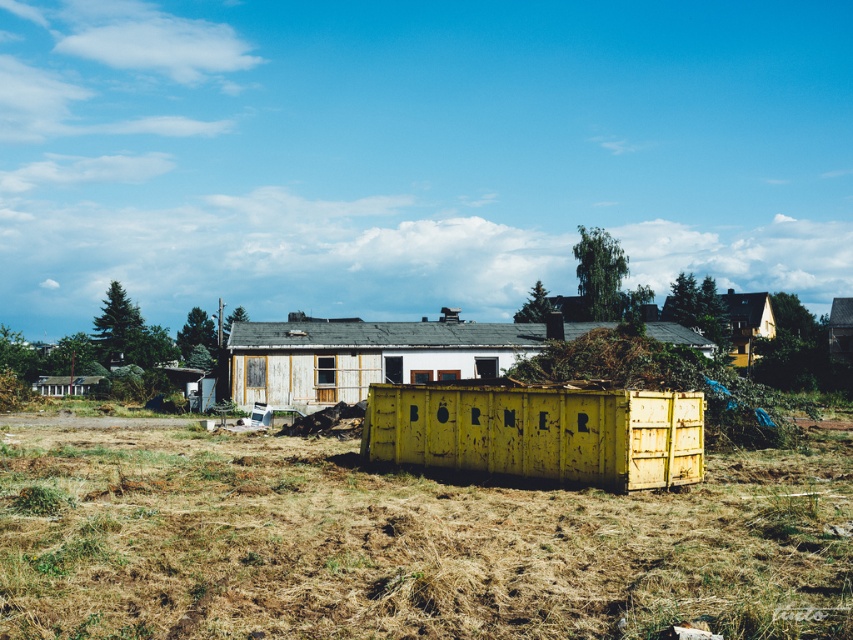
Does rusty yellow container at center appear over yellow weathered container at center?

Actually, rusty yellow container at center is below yellow weathered container at center.

Can you confirm if rusty yellow container at center is positioned below yellow weathered container at center?

Indeed, rusty yellow container at center is positioned under yellow weathered container at center.

You are a GUI agent. You are given a task and a screenshot of the screen. Output one action in this format:
    pyautogui.click(x=<x>, y=<y>)
    Task: Click on the rusty yellow container at center
    This screenshot has width=853, height=640.
    Given the screenshot: What is the action you would take?
    pyautogui.click(x=538, y=433)

Where is `rusty yellow container at center`? Image resolution: width=853 pixels, height=640 pixels. rusty yellow container at center is located at coordinates (538, 433).

Between dry grass at center and wooden hut at left, which one is positioned lower?

Positioned lower is wooden hut at left.

Find the location of `dry grass at center`. dry grass at center is located at coordinates (401, 541).

In the scene shown: Is dry grass at center bigger than yellow weathered container at center?

Incorrect, dry grass at center is not larger than yellow weathered container at center.

Where is `dry grass at center`? Image resolution: width=853 pixels, height=640 pixels. dry grass at center is located at coordinates (401, 541).